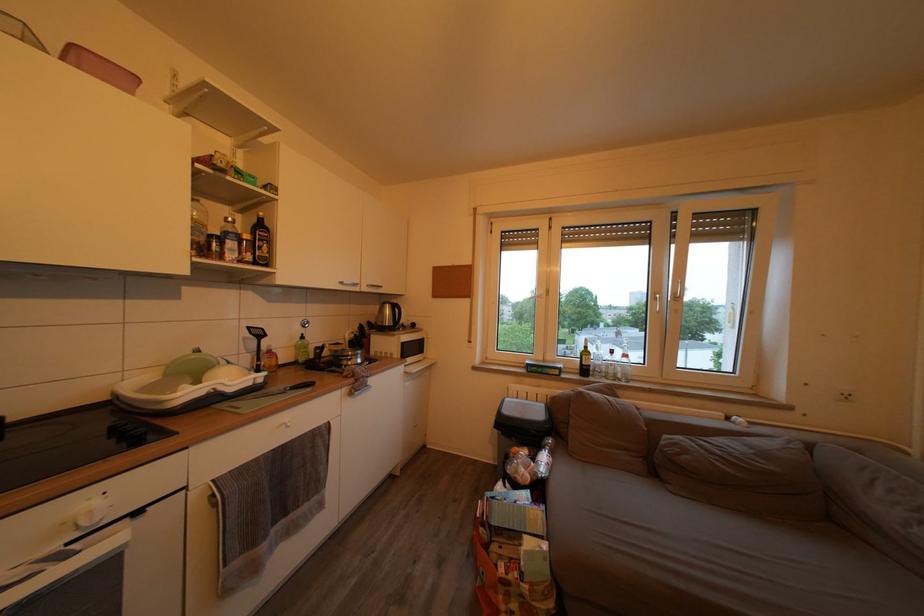
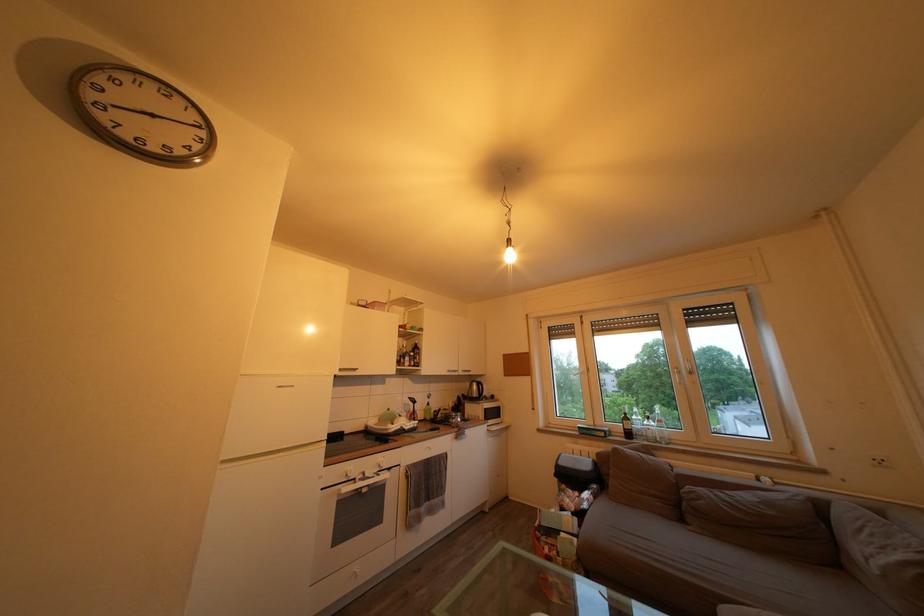
The point at (593,359) is marked in the first image. Where is the corresponding point in the second image?

(635, 424)